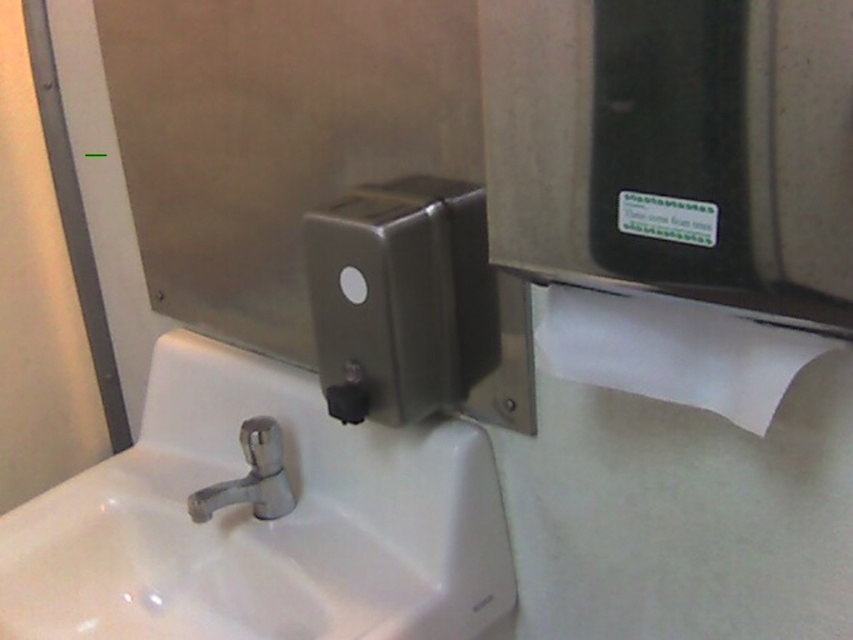
Can you confirm if stainless steel hand dryer at upper right is smaller than chrome metallic faucet at center?

No, stainless steel hand dryer at upper right is not smaller than chrome metallic faucet at center.

Who is more distant from viewer, (846, 289) or (258, 477)?

Point (258, 477)

Image resolution: width=853 pixels, height=640 pixels. What do you see at coordinates (675, 148) in the screenshot?
I see `stainless steel hand dryer at upper right` at bounding box center [675, 148].

You are a GUI agent. You are given a task and a screenshot of the screen. Output one action in this format:
    pyautogui.click(x=<x>, y=<y>)
    Task: Click on the stainless steel hand dryer at upper right
    This screenshot has height=640, width=853.
    Given the screenshot: What is the action you would take?
    pyautogui.click(x=675, y=148)

Which is in front, point (515, 120) or point (763, 384)?

Point (763, 384) is more forward.

Is point (611, 189) positioned in front of point (618, 349)?

That is True.

Locate an element on the screen. The height and width of the screenshot is (640, 853). stainless steel hand dryer at upper right is located at coordinates (675, 148).

Between satin nickel dispenser at center and white paper at right, which one appears on the right side from the viewer's perspective?

From the viewer's perspective, white paper at right appears more on the right side.

Can you confirm if satin nickel dispenser at center is positioned above white paper at right?

Yes, satin nickel dispenser at center is above white paper at right.

Is point (427, 225) more distant than point (553, 358)?

Yes, it is.

Where is `satin nickel dispenser at center`? satin nickel dispenser at center is located at coordinates (416, 307).